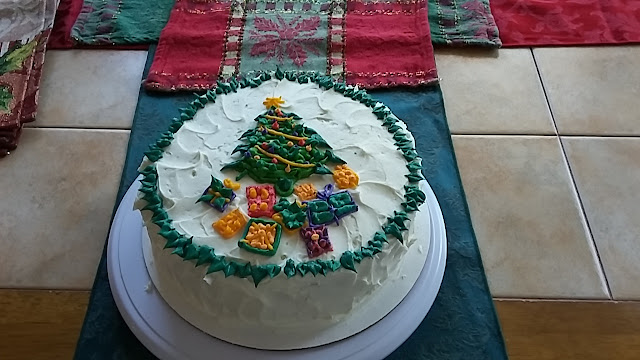
Where is `red table runner`? red table runner is located at coordinates (525, 30), (614, 34), (61, 28).